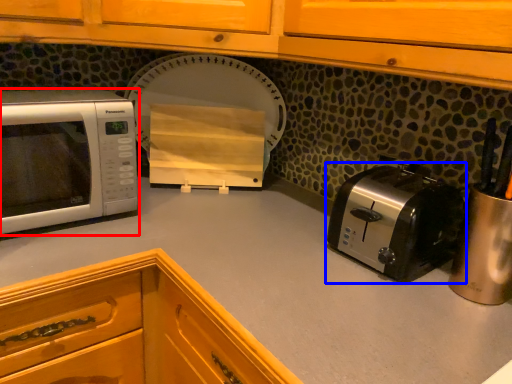
Question: Which object appears farthest to the camera in this image, microwave oven (highlighted by a red box) or toaster (highlighted by a blue box)?

Choices:
 (A) microwave oven
 (B) toaster

Answer: (A)